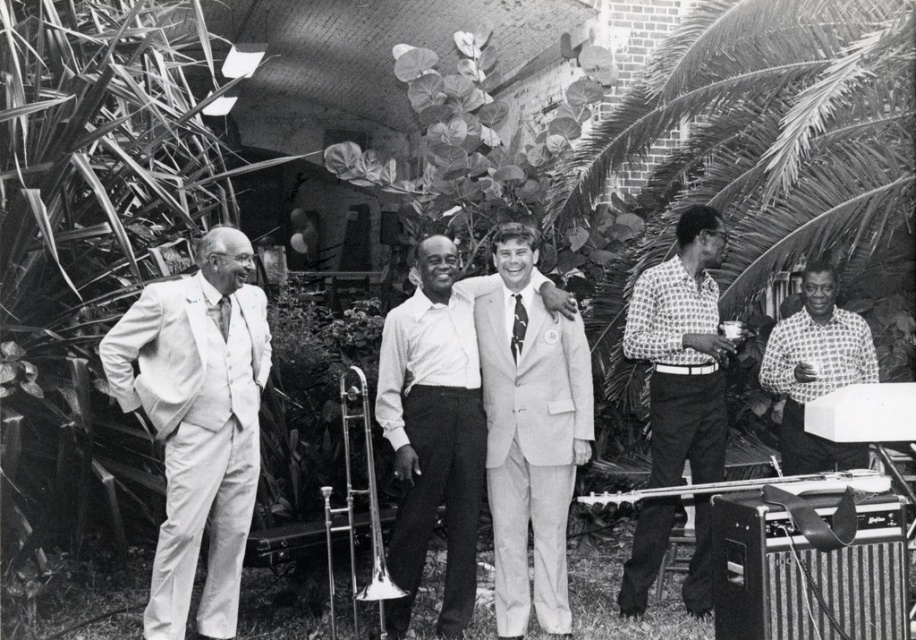
Where is `light gray wool suit at center`? This screenshot has width=916, height=640. light gray wool suit at center is located at coordinates (531, 449).

Between point (544, 401) and point (219, 324), which one is positioned behind?

Positioned behind is point (544, 401).

Does point (578, 369) come farther from viewer compared to point (229, 317)?

Yes.

At what (x,y) coordinates should I click in order to perform the action: click on light gray wool suit at center. Please return your answer as a coordinate pair (x, y). The image size is (916, 640). Looking at the image, I should click on (531, 449).

Measure the distance from light gray suit at center to checkered shirt at center.

They are 1.92 meters apart.

Can you confirm if light gray suit at center is smaller than checkered shirt at center?

No, light gray suit at center is not smaller than checkered shirt at center.

Who is more distant from viewer, (413, 490) or (788, 364)?

The point (788, 364) is behind.

Find the location of a particular element. light gray suit at center is located at coordinates (434, 433).

Which is behind, point (815, 456) or point (222, 307)?

Positioned behind is point (815, 456).

Is checkered shirt at center further to camera compared to matte black tie at left?

Yes.

This screenshot has height=640, width=916. What do you see at coordinates (816, 371) in the screenshot?
I see `checkered shirt at center` at bounding box center [816, 371].

The height and width of the screenshot is (640, 916). Find the location of `checkered shirt at center`. checkered shirt at center is located at coordinates (816, 371).